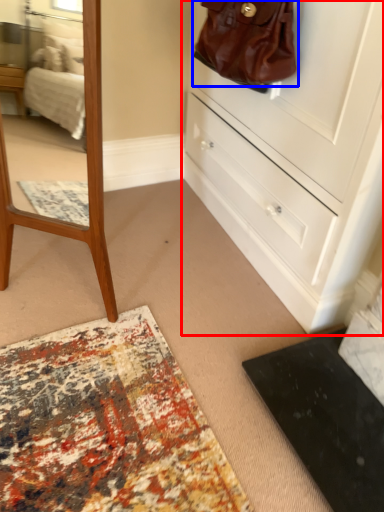
Question: Which of the following is the farthest to the observer, chest of drawers (highlighted by a red box) or handbag (highlighted by a blue box)?

Choices:
 (A) chest of drawers
 (B) handbag

Answer: (B)